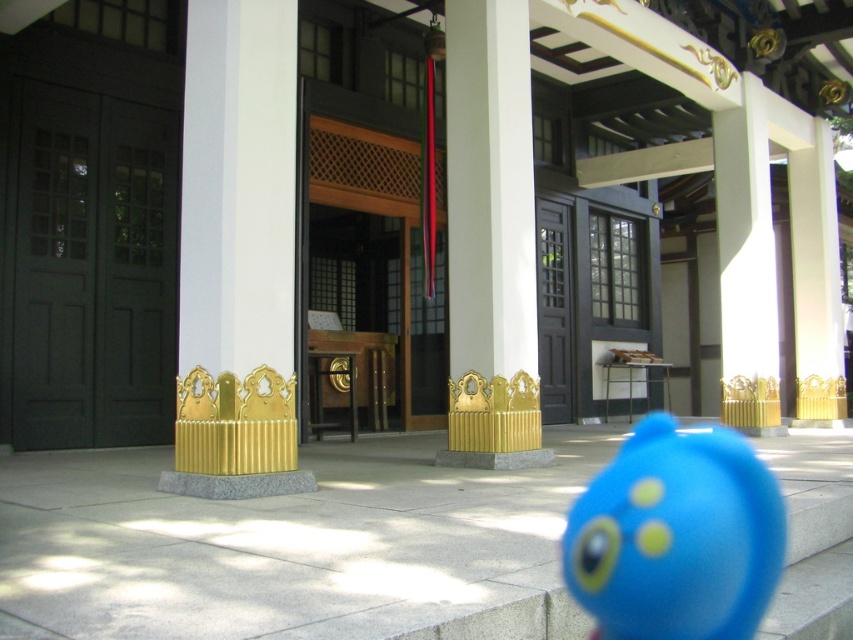
Question: Can you confirm if matte dark green door at left is wider than gold metallic pillar at center?

Choices:
 (A) yes
 (B) no

Answer: (A)

Question: Which object is the closest to the blue rubber toy at center?

Choices:
 (A) matte dark green door at left
 (B) gold metallic pillar at center

Answer: (B)

Question: Among these objects, which one is farthest from the camera?

Choices:
 (A) blue rubber toy at center
 (B) matte dark green door at left

Answer: (B)

Question: Which of these objects is positioned farthest from the matte dark green door at left?

Choices:
 (A) blue rubber toy at center
 (B) gold metallic pillar at center

Answer: (A)

Question: Considering the relative positions of matte dark green door at left and blue rubber toy at center in the image provided, where is matte dark green door at left located with respect to blue rubber toy at center?

Choices:
 (A) above
 (B) below

Answer: (A)

Question: Considering the relative positions of matte dark green door at left and gold metallic pillar at center in the image provided, where is matte dark green door at left located with respect to gold metallic pillar at center?

Choices:
 (A) left
 (B) right

Answer: (A)